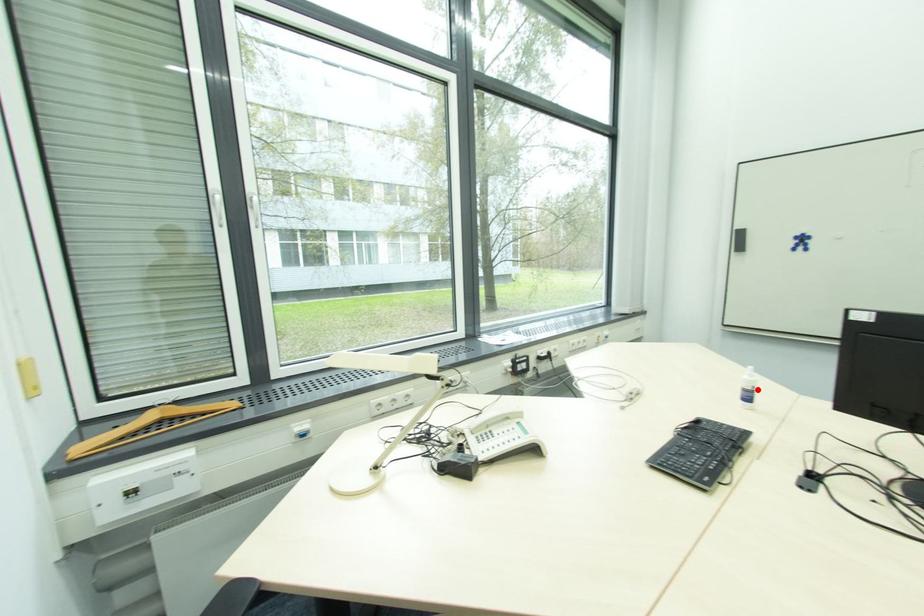
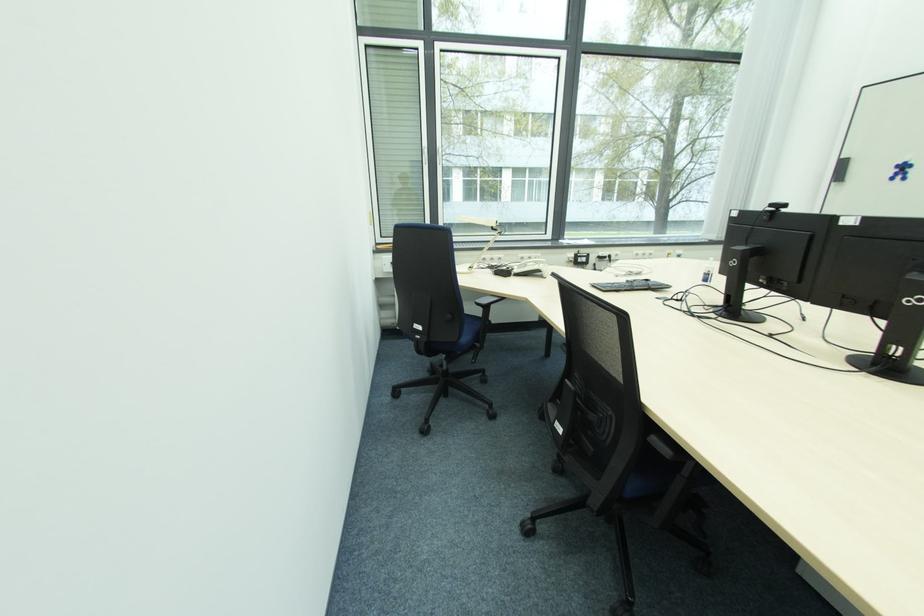
Find the pixel in the second image that matches the highlighted location in the first image.

(712, 274)